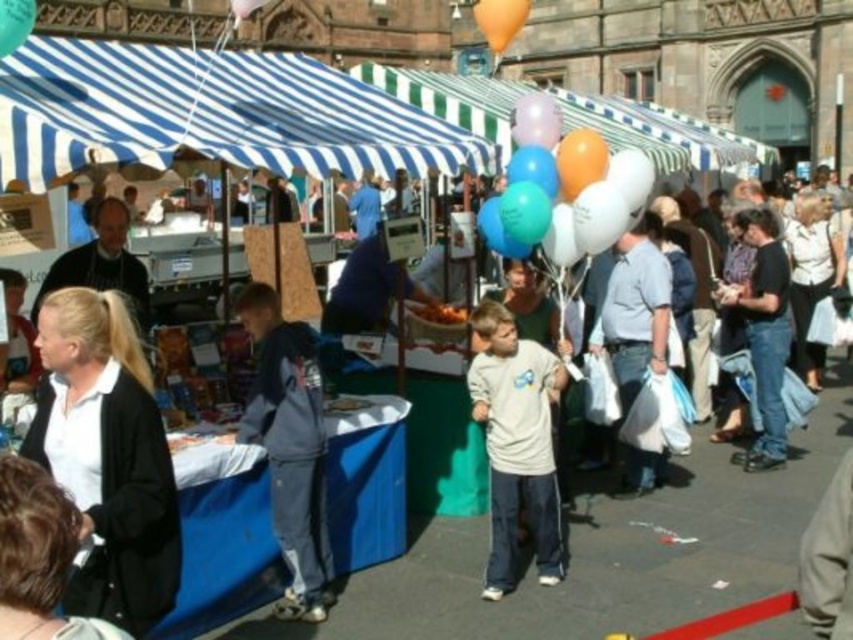
Question: Can you confirm if blue striped canopy at upper left is wider than matte green balloon at upper left?

Choices:
 (A) yes
 (B) no

Answer: (A)

Question: Among these objects, which one is farthest from the camera?

Choices:
 (A) light gray cotton shirt at center
 (B) matte white balloons at center
 (C) dark gray fleece jacket at center
 (D) matte green balloon at upper left

Answer: (B)

Question: Which point appears closest to the camera in this image?

Choices:
 (A) (35, 13)
 (B) (509, 532)
 (C) (277, 86)

Answer: (B)

Question: Observing the image, what is the correct spatial positioning of light gray cotton shirt at center in reference to matte green balloon at upper left?

Choices:
 (A) right
 (B) left

Answer: (A)

Question: Which object appears farthest from the camera in this image?

Choices:
 (A) blue striped canopy at upper left
 (B) orange matte balloon at upper center
 (C) matte white balloons at center
 (D) matte green balloon at upper left

Answer: (B)

Question: Can you confirm if blue striped canopy at upper left is wider than orange matte balloon at upper center?

Choices:
 (A) no
 (B) yes

Answer: (B)